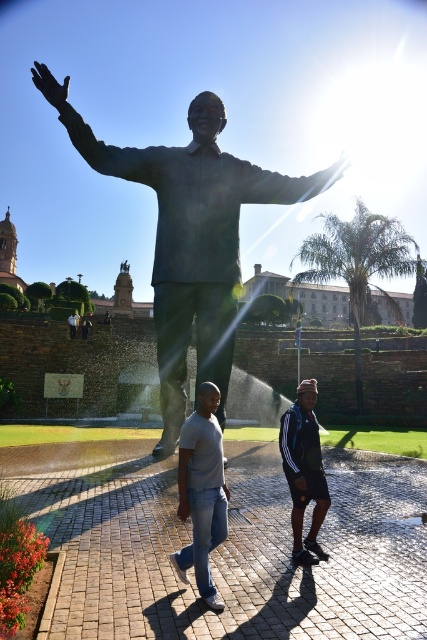
Which is below, bronze statue at center or light gray t-shirt at center?

light gray t-shirt at center is below.

Which is in front, point (180, 218) or point (205, 596)?

Point (205, 596) is more forward.

At what (x,y) coordinates should I click in order to perform the action: click on bronze statue at center. Please return your answer as a coordinate pair (x, y). Looking at the image, I should click on (190, 236).

Identify the location of bronze statue at center. (190, 236).

Is light gray t-shirt at center wider than dark blue jersey at center?

Yes.

Which is behind, point (210, 525) or point (315, 547)?

Positioned behind is point (315, 547).

Is point (225, 515) farther from camera compared to point (312, 444)?

No, it is in front of (312, 444).

At what (x,y) coordinates should I click in order to perform the action: click on light gray t-shirt at center. Please return your answer as a coordinate pair (x, y). The width and height of the screenshot is (427, 640). Looking at the image, I should click on (201, 492).

Is bronze statue at center shorter than dark blue jersey at center?

In fact, bronze statue at center may be taller than dark blue jersey at center.

Which is above, bronze statue at center or dark blue jersey at center?

bronze statue at center is above.

Does point (175, 298) come farther from viewer compared to point (301, 410)?

Yes.

In order to click on bronze statue at center in this screenshot , I will do `click(190, 236)`.